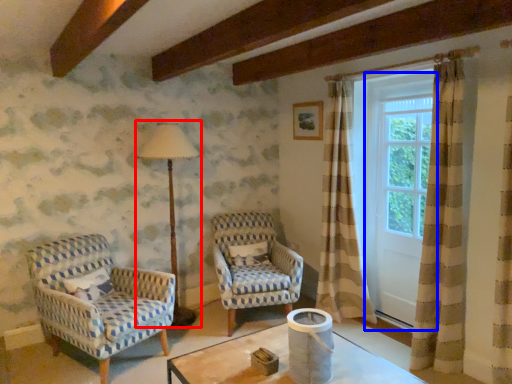
Question: Which object is closer to the camera taking this photo, table lamp (highlighted by a red box) or screen door (highlighted by a blue box)?

Choices:
 (A) table lamp
 (B) screen door

Answer: (B)